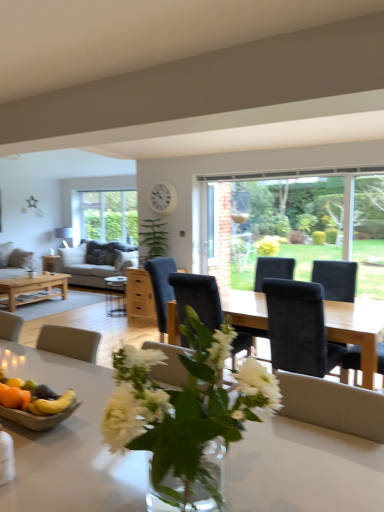
Question: From a real-world perspective, is wooden bowl of fruit at lower left physically located above or below white glossy table at center?

Choices:
 (A) below
 (B) above

Answer: (A)

Question: Do you think wooden bowl of fruit at lower left is within white glossy table at center, or outside of it?

Choices:
 (A) inside
 (B) outside

Answer: (B)

Question: Estimate the real-world distances between objects in this image. Which object is farther from the yellow matte bananas at lower left?

Choices:
 (A) white plastic clock at upper center
 (B) suede black chair at center
 (C) light gray fabric couch at center-left, acting as the 2th studio couch starting from the left
 (D) white glossy table at center
 (E) suede-like gray pillow at center

Answer: (E)

Question: Which of these objects is positioned closest to the white glossy table at center?

Choices:
 (A) wooden bowl of fruit at lower left
 (B) suede-like gray pillow at center
 (C) light gray fabric couch at center-left, positioned as the first studio couch in right-to-left order
 (D) white plastic clock at upper center
 (E) matte wooden coffee table at center, positioned as the 2th coffee table in left-to-right order

Answer: (A)